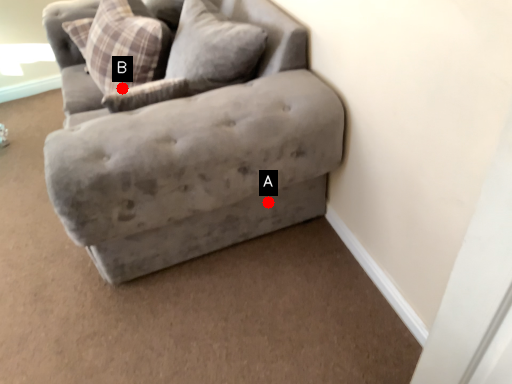
Question: Two points are circled on the image, labeled by A and B beside each circle. Which point is farther to the camera?

Choices:
 (A) A is further
 (B) B is further

Answer: (B)